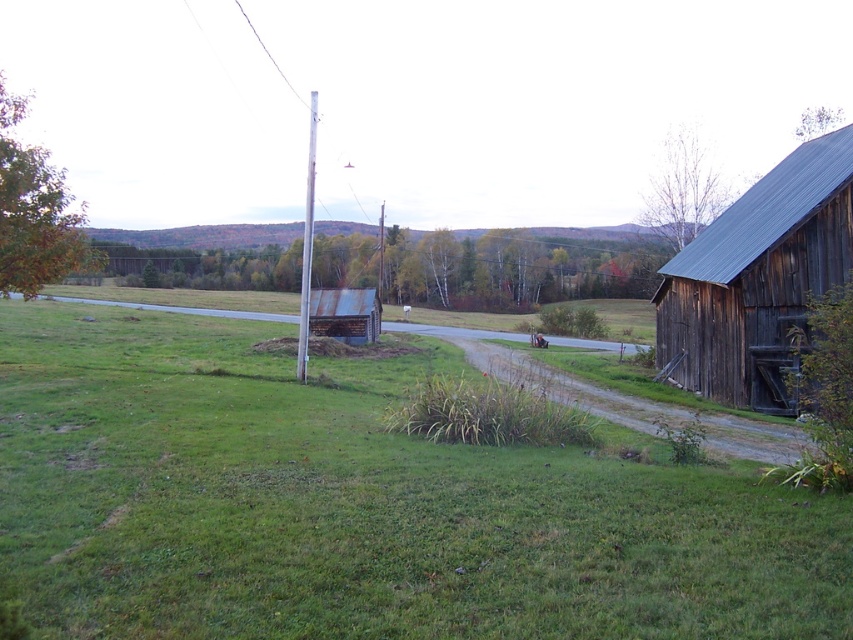
Question: Which point appears closest to the camera in this image?

Choices:
 (A) (601, 525)
 (B) (793, 260)

Answer: (A)

Question: Is green grass at center to the right of dark brown wooden barn at right from the viewer's perspective?

Choices:
 (A) no
 (B) yes

Answer: (A)

Question: Can you confirm if green grass at center is smaller than dark brown wooden barn at right?

Choices:
 (A) yes
 (B) no

Answer: (A)

Question: Can you confirm if green grass at center is wider than dark brown wooden barn at right?

Choices:
 (A) no
 (B) yes

Answer: (B)